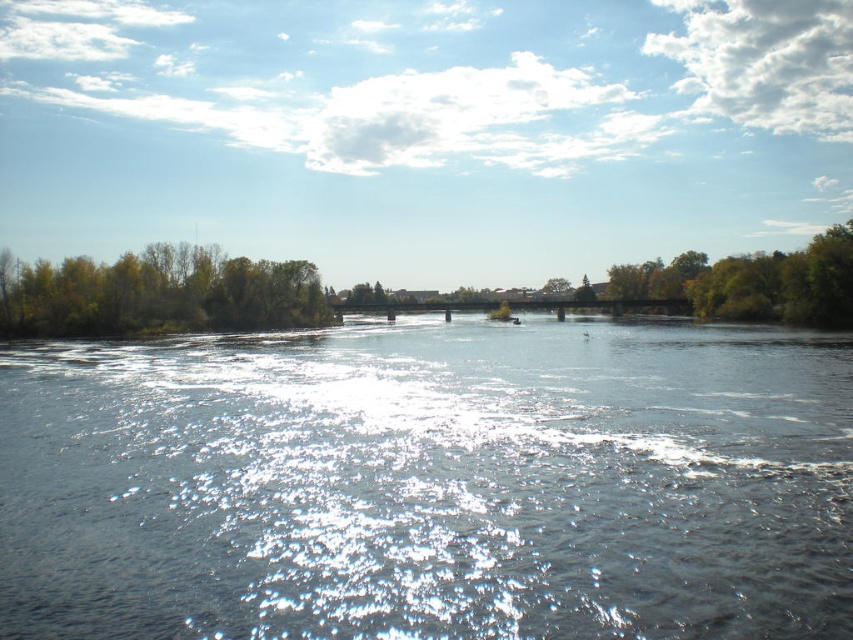
You are standing at the center of the bridge in the middle ground of the riverscape. You notice two points marked in the scene. The first point is at coordinates point (117, 625) and the second is at point (833, 269). Which of these points is nearer to your current position?

Point (117, 625) is closer to the camera than point (833, 269), so the first point is nearer to your current position on the bridge.

You are a kayaker planning to paddle from the left bank to the right bank. You see the clear water at center and the green leafy tree at right. Which direction should you aim for to reach the right bank safely?

You should aim towards the green leafy tree at right because the clear water at center is positioned on the left side of the green leafy tree at right, indicating that the right bank is beyond the tree.

You are standing on the bridge and want to take a photo that includes both the green leafy trees at left and the green leafy tree at right. Which tree should you position closer to the front of the frame to ensure both are in focus?

You should position the green leafy trees at left closer to the front of the frame because they are in front of the green leafy tree at right. This way, both will be in focus as the foreground and background elements are properly aligned.